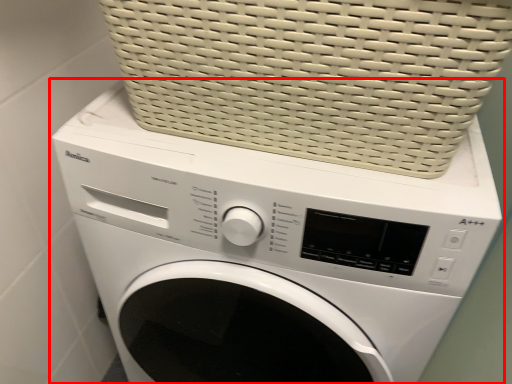
Question: From the image's perspective, what is the correct spatial positioning of washing machine (annotated by the red box) in reference to basket?

Choices:
 (A) below
 (B) above

Answer: (A)